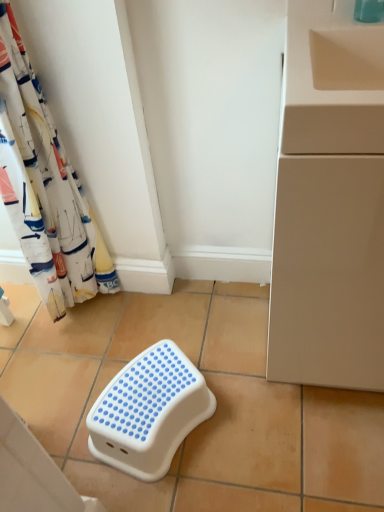
Identify the location of spots to the right of white fabric curtain at left. (139, 309).